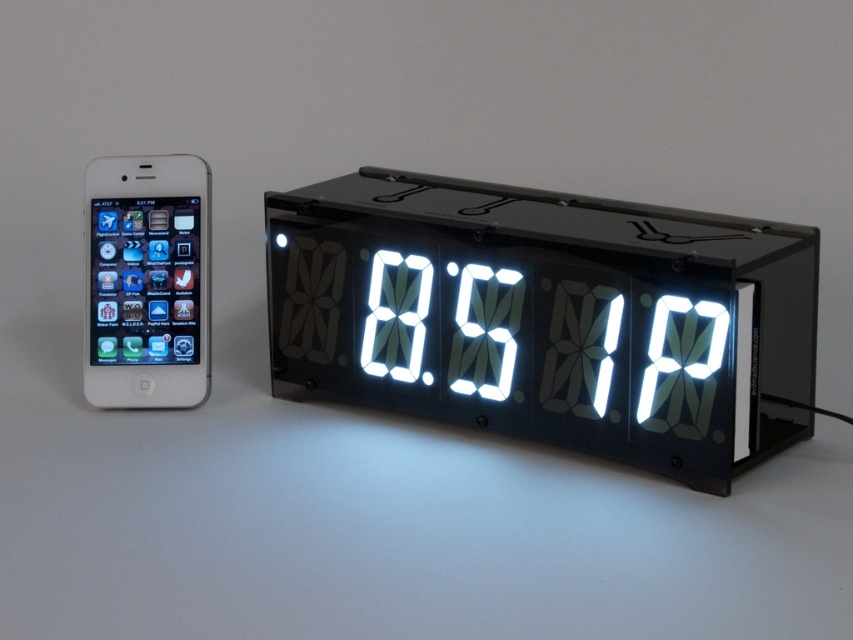
Can you confirm if white led display at center is shorter than white glossy smartphone at left?

No, white led display at center is not shorter than white glossy smartphone at left.

Does point (561, 211) lie behind point (96, 193)?

That is False.

Based on the photo, who is more distant from viewer, (614, 397) or (131, 157)?

Point (131, 157)

What are the coordinates of `white led display at center` in the screenshot? It's located at (548, 316).